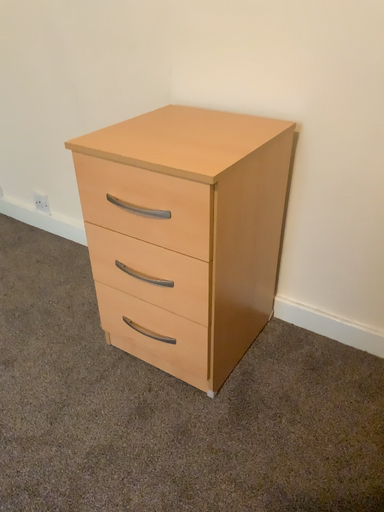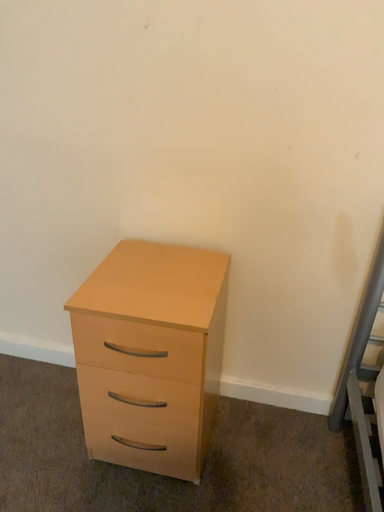
Question: How did the camera likely rotate when shooting the video?

Choices:
 (A) rotated left
 (B) rotated right

Answer: (B)